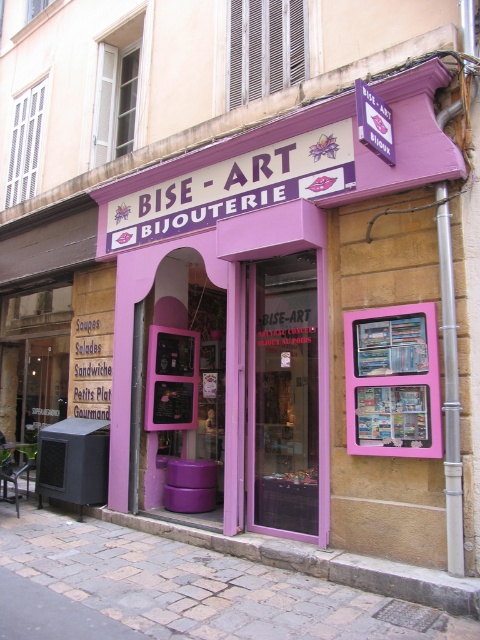
You are standing in front of the Bise Art Bijouterie store and want to know which of the two points, point (99, 609) or point (409, 333), is closer to you. Can you determine this based on the store layout?

Point (99, 609) is closer to the viewer than point (409, 333).

You are standing in front of the Bise Art Bijouterie store. You want to place a small potted plant on the paved stone pavement at lower center. Where exactly should you place it?

You should place the small potted plant at point (200, 586) on the paved stone pavement at lower center.

You are standing in front of the Bise Art Bijouterie store. You see a point marked at coordinates [200,586]. What is located at that point?

The point at coordinates [200,586] marks the paved stone pavement at lower center.